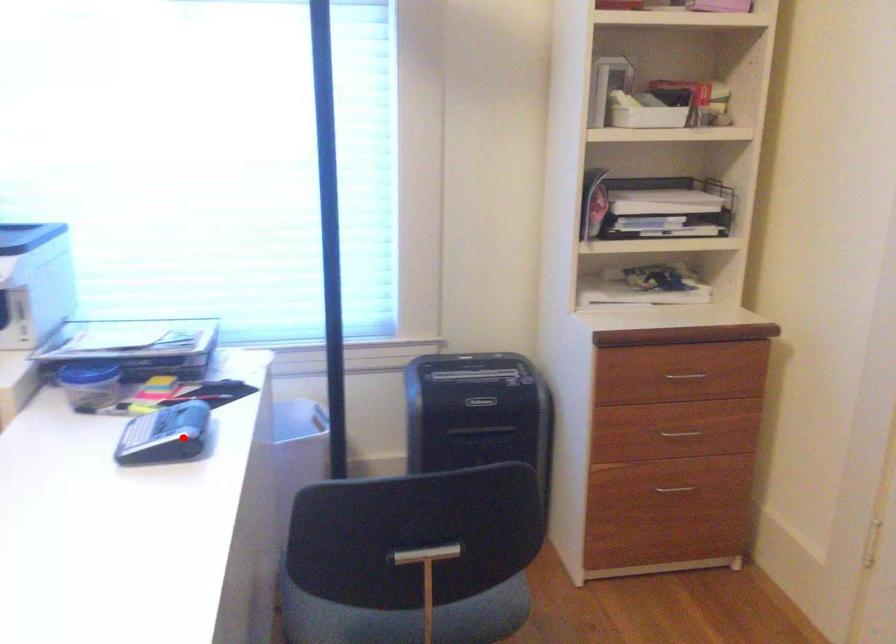
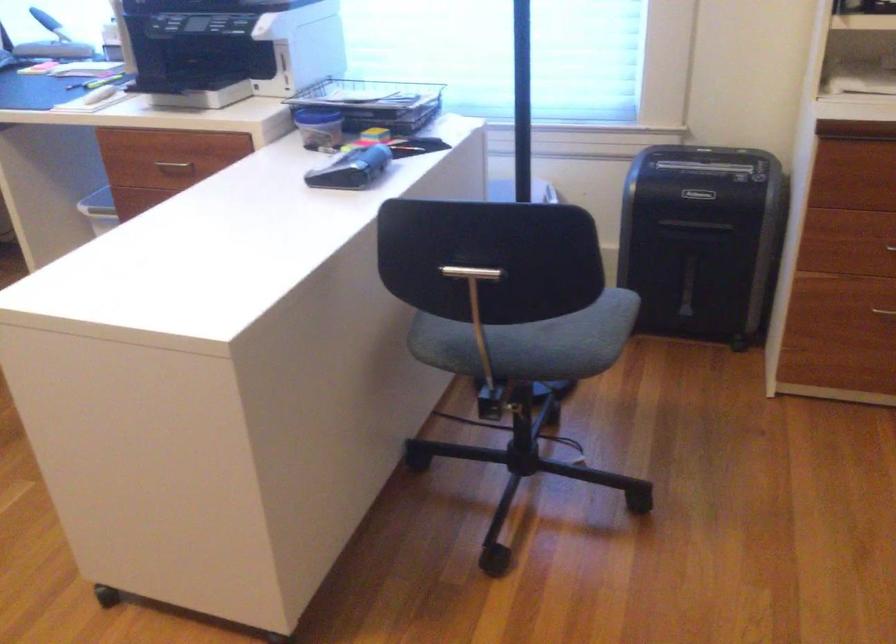
Question: A red point is marked in image1. In image2, is the corresponding 3D point closer to the camera or farther? Reply with the corresponding letter.

Choices:
 (A) The corresponding 3D point is closer.
 (B) The corresponding 3D point is farther.

Answer: (B)